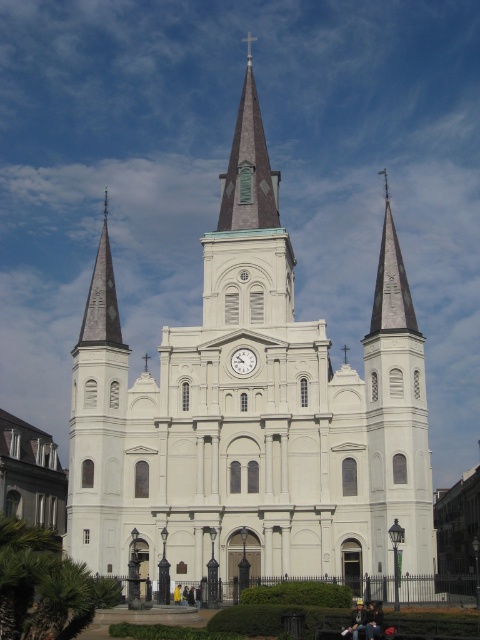
Can you confirm if green copper spire at upper center is positioned below matte white clock at center?

No, green copper spire at upper center is not below matte white clock at center.

Is point (243, 38) less distant than point (253, 368)?

No, (243, 38) is further to viewer.

Locate an element on the screen. The image size is (480, 640). green copper spire at upper center is located at coordinates (249, 168).

Does white smooth church at center have a greater height compared to green copper spire at upper center?

Correct, white smooth church at center is much taller as green copper spire at upper center.

Which is below, white smooth church at center or green copper spire at upper center?

white smooth church at center is lower down.

Which is in front, point (115, 461) or point (251, 140)?

Positioned in front is point (115, 461).

Locate an element on the screen. white smooth church at center is located at coordinates (251, 413).

Between point (80, 330) and point (235, 358), which one is positioned in front?

Point (235, 358)

Which of these two, white stone steeple at left or matte white clock at center, stands taller?

white stone steeple at left is taller.

Find the location of a particular element. This screenshot has height=640, width=480. white stone steeple at left is located at coordinates (97, 422).